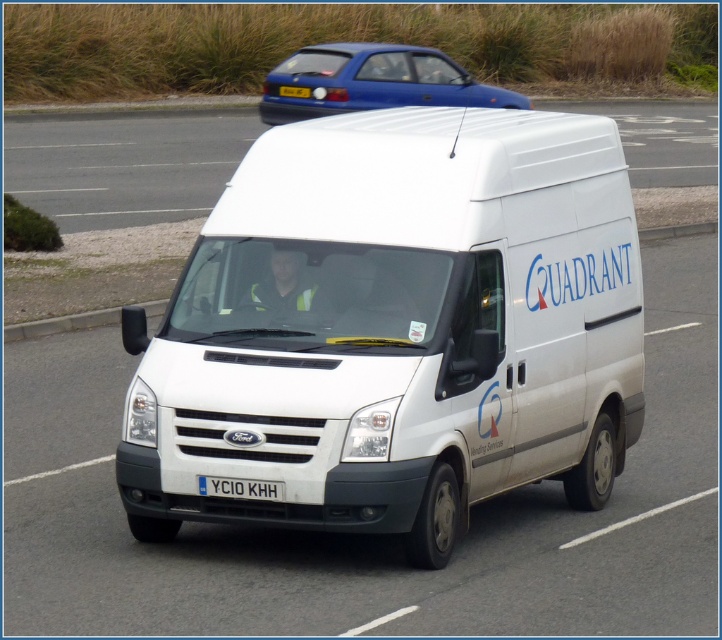
You are a traffic officer observing the road. You notice two vans, a white matte van at center and a white glossy van at center. Which van is wider?

The white glossy van at center is wider than the white matte van at center according to the description.

You are a passenger in the white Ford Transit van and want to know which of the two points, point (508,104) or point (206,488), is closer to you. Based on the scene description, can you determine which point is nearer?

Point (508,104) is further to the viewer than point (206,488), so the point (206,488) is closer to you.

You are a pedestrian standing on the roadside. You see a white matte van at center and a white glossy van at center. Which van is closer to the left side of the road?

The white matte van at center is positioned on the left side of the white glossy van at center, so it is closer to the left side of the road.